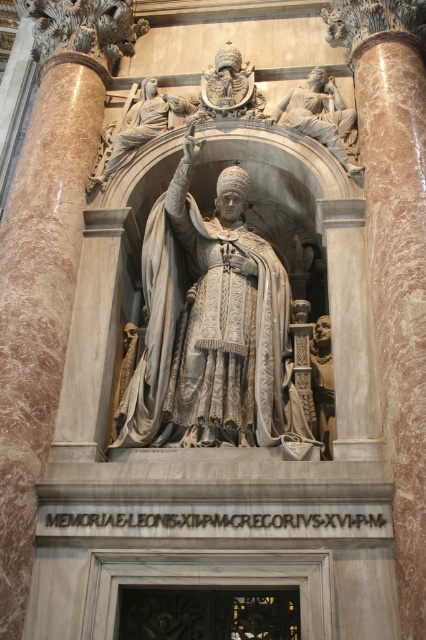
Between marble column at right and polished marble statue at center, which one appears on the right side from the viewer's perspective?

Positioned to the right is marble column at right.

Who is taller, marble column at right or polished marble statue at center?

marble column at right

Find the location of a particular element. The image size is (426, 640). marble column at right is located at coordinates (397, 284).

Is polished marble statue at center positioned at the back of polished bronze helmet at upper center?

No, it is in front of polished bronze helmet at upper center.

The height and width of the screenshot is (640, 426). Identify the location of polished marble statue at center. (143, 124).

Is marble statue at upper center in front of polished stone statue at center?

No, it is behind polished stone statue at center.

Is marble statue at upper center below polished stone statue at center?

No, marble statue at upper center is not below polished stone statue at center.

Between point (293, 93) and point (331, 458), which one is positioned in front?

Positioned in front is point (331, 458).

At what (x,y) coordinates should I click in order to perform the action: click on marble statue at upper center. Please return your answer as a coordinate pair (x, y). Looking at the image, I should click on (319, 115).